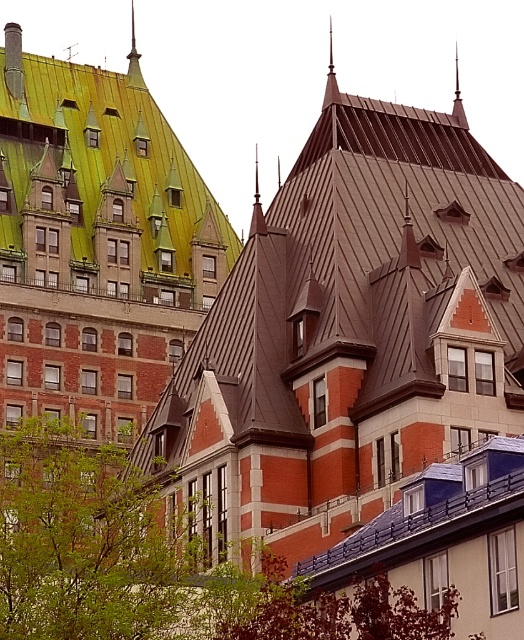
You are an architect analyzing the spatial relationship between the green corrugated metal roof at upper left and the green corrugated metal spire at upper center in the image. Which object is closer to the viewer?

The green corrugated metal roof at upper left is closer to the viewer because it is positioned in front of the green corrugated metal spire at upper center.

You are a tourist standing at the entrance of the historic urban area and want to take a photo that includes both the green leafy tree at lower left and the green corrugated metal spire at upper center. Based on their positions, which object should you position closer to the left side of your camera frame to include both in the shot?

The green leafy tree at lower left is to the right of the green corrugated metal spire at upper center, so to include both in the photo, you should position the green corrugated metal spire at upper center closer to the left side of your camera frame.